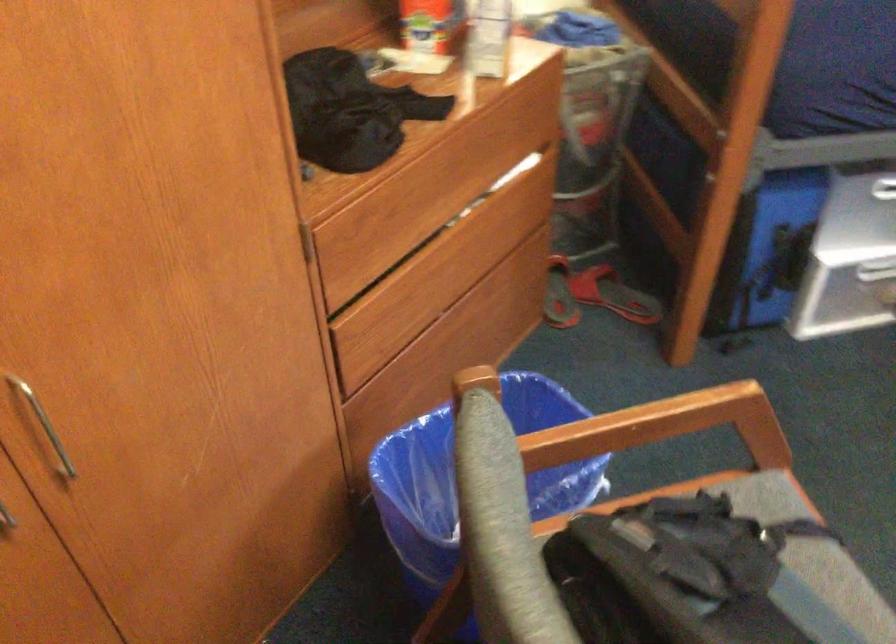
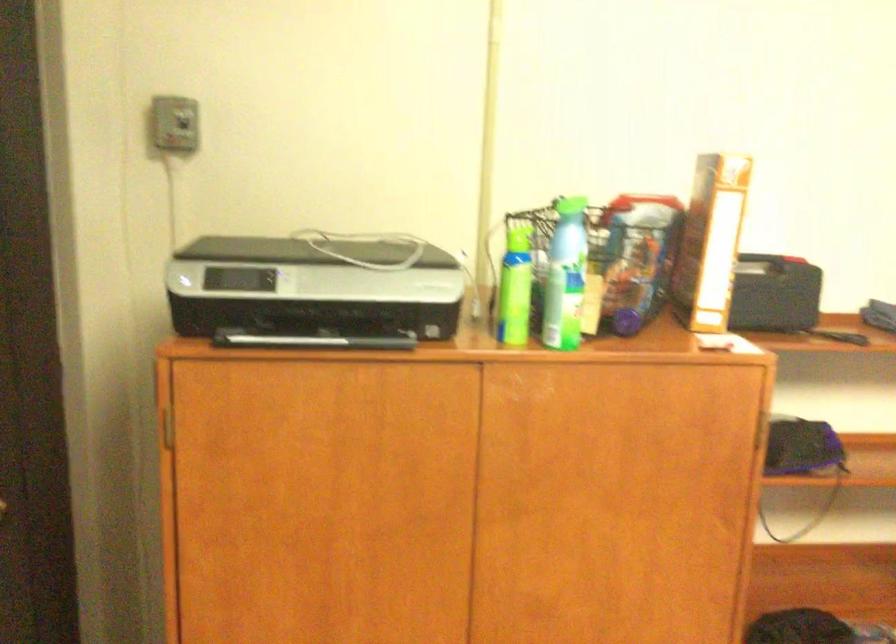
Consider the image. The first image is from the beginning of the video and the second image is from the end. How did the camera likely rotate when shooting the video?

The rotation direction of the camera is left-up.